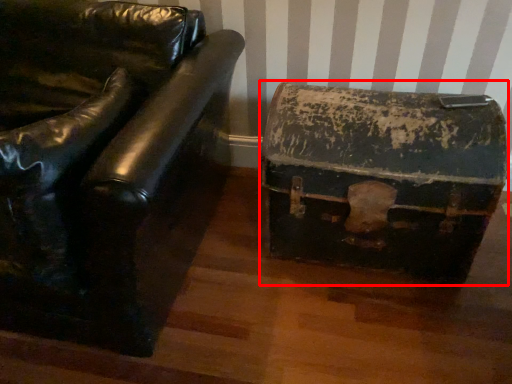
Question: In this image, where is storage box (annotated by the red box) located relative to furniture?

Choices:
 (A) left
 (B) right

Answer: (B)